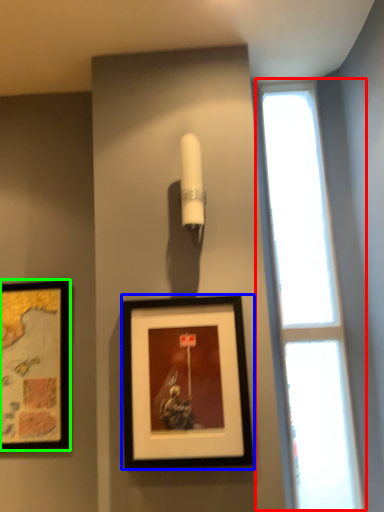
Question: Estimate the real-world distances between objects in this image. Which object is closer to window (highlighted by a red box), picture frame (highlighted by a blue box) or picture frame (highlighted by a green box)?

Choices:
 (A) picture frame
 (B) picture frame

Answer: (A)